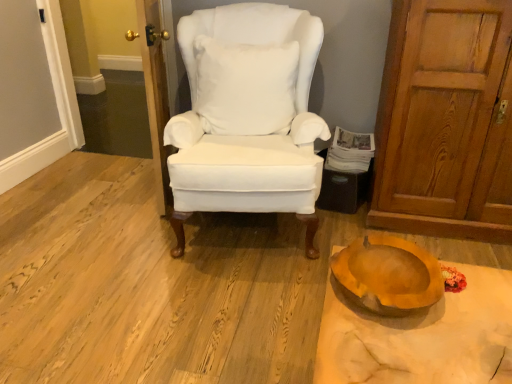
Describe the element at coordinates (422, 337) in the screenshot. I see `wooden bowl at lower right` at that location.

Find the location of a particular element. The height and width of the screenshot is (384, 512). wooden bowl at lower right is located at coordinates (422, 337).

Describe the element at coordinates (245, 87) in the screenshot. The width and height of the screenshot is (512, 384). I see `white fluffy pillow at center` at that location.

What do you see at coordinates (248, 131) in the screenshot? The width and height of the screenshot is (512, 384). I see `white fabric chair at center` at bounding box center [248, 131].

Image resolution: width=512 pixels, height=384 pixels. I want to click on wooden bowl at lower right, so click(422, 337).

Does wooden door at left, which is counted as the second door, starting from the right, have a smaller size compared to white fabric chair at center?

Indeed, wooden door at left, which is counted as the second door, starting from the right, has a smaller size compared to white fabric chair at center.

Is wooden door at left, which is counted as the second door, starting from the right, positioned with its back to white fabric chair at center?

Yes, wooden door at left, which is counted as the second door, starting from the right,'s orientation is away from white fabric chair at center.

Can you confirm if wooden door at left, the 1th door positioned from the left, is positioned to the right of white fabric chair at center?

Incorrect, wooden door at left, the 1th door positioned from the left, is not on the right side of white fabric chair at center.

Locate an element on the screen. table below the white fabric chair at center (from the image's perspective) is located at coordinates (422, 337).

Is white fabric chair at center not close to wooden bowl at lower right?

That's right, there is a large distance between white fabric chair at center and wooden bowl at lower right.

From a real-world perspective, who is located higher, white fabric chair at center or wooden bowl at lower right?

In real-world perspective, white fabric chair at center is above.

Can you confirm if white fabric chair at center is positioned to the left of wooden bowl at lower right?

Yes.

Between matte orange bowl at lower right and wooden door at left, the 1th door positioned from the left, which one appears on the left side from the viewer's perspective?

From the viewer's perspective, wooden door at left, the 1th door positioned from the left, appears more on the left side.

Based on the photo, which point is more forward, [362,267] or [155,165]?

The point [362,267] is closer.

Is matte orange bowl at lower right turned away from wooden door at left, which is counted as the second door, starting from the right?

No, wooden door at left, which is counted as the second door, starting from the right, is not at the back of matte orange bowl at lower right.

Can you see matte orange bowl at lower right touching wooden door at left, which is counted as the second door, starting from the right?

matte orange bowl at lower right is not next to wooden door at left, which is counted as the second door, starting from the right, and they're not touching.

You are a GUI agent. You are given a task and a screenshot of the screen. Output one action in this format:
    pyautogui.click(x=<x>, y=<y>)
    Task: Click on the table located below the wooden door at right, arranged as the first door when viewed from the right (from the image's perspective)
    The width and height of the screenshot is (512, 384).
    Given the screenshot: What is the action you would take?
    pyautogui.click(x=422, y=337)

Considering the sizes of objects wooden door at right, arranged as the first door when viewed from the right, and wooden bowl at lower right in the image provided, who is shorter, wooden door at right, arranged as the first door when viewed from the right, or wooden bowl at lower right?

wooden bowl at lower right is shorter.

Is wooden door at right, arranged as the first door when viewed from the right, thinner than wooden bowl at lower right?

Indeed, wooden door at right, arranged as the first door when viewed from the right, has a lesser width compared to wooden bowl at lower right.

Can we say wooden door at right, the second door positioned from the left, lies outside wooden bowl at lower right?

Indeed, wooden door at right, the second door positioned from the left, is completely outside wooden bowl at lower right.

Can you tell me how much matte orange bowl at lower right and white fabric chair at center differ in facing direction?

They differ by 99.6 degrees in their facing directions.

Is matte orange bowl at lower right facing towards white fabric chair at center?

No.

Is matte orange bowl at lower right to the left or to the right of white fabric chair at center in the image?

matte orange bowl at lower right is positioned on white fabric chair at center's right side.

Is matte orange bowl at lower right taller or shorter than white fabric chair at center?

matte orange bowl at lower right is shorter than white fabric chair at center.

Does wooden door at left, the 1th door positioned from the left, have a smaller size compared to white fluffy pillow at center?

No, wooden door at left, the 1th door positioned from the left, is not smaller than white fluffy pillow at center.

Is wooden door at left, which is counted as the second door, starting from the right, directly adjacent to white fluffy pillow at center?

No.

Does point (166, 189) come closer to viewer compared to point (232, 75)?

That is False.

Is the surface of white fabric chair at center in direct contact with white paper magazine at right?

white fabric chair at center and white paper magazine at right are clearly separated.

Is white fabric chair at center positioned beyond the bounds of white paper magazine at right?

That's correct, white fabric chair at center is outside of white paper magazine at right.

Looking at the image, does white fabric chair at center seem bigger or smaller compared to white paper magazine at right?

In the image, white fabric chair at center appears to be larger than white paper magazine at right.

From a real-world perspective, who is located higher, white fabric chair at center or white paper magazine at right?

white fabric chair at center is physically above.

At what (x,y) coordinates should I click in order to perform the action: click on chair below the wooden door at left, which is counted as the second door, starting from the right (from the image's perspective). Please return your answer as a coordinate pair (x, y). The height and width of the screenshot is (384, 512). Looking at the image, I should click on (248, 131).

Where is `chair lying on the left of wooden bowl at lower right`? chair lying on the left of wooden bowl at lower right is located at coordinates [248, 131].

Based on their spatial positions, is white fabric chair at center or matte orange bowl at lower right further from white fluffy pillow at center?

matte orange bowl at lower right lies further to white fluffy pillow at center than the other object.

When comparing their distances from white paper magazine at right, does wooden bowl at lower right or wooden door at right, arranged as the first door when viewed from the right, seem closer?

The object closer to white paper magazine at right is wooden door at right, arranged as the first door when viewed from the right.

Looking at the image, which one is located further to white paper magazine at right, white fluffy pillow at center or wooden bowl at lower right?

Among the two, wooden bowl at lower right is located further to white paper magazine at right.

Considering their positions, is wooden door at left, the 1th door positioned from the left, positioned closer to wooden bowl at lower right than white fabric chair at center?

white fabric chair at center lies closer to wooden bowl at lower right than the other object.

From the image, which object appears to be nearer to white paper magazine at right, wooden bowl at lower right or white fluffy pillow at center?

Based on the image, white fluffy pillow at center appears to be nearer to white paper magazine at right.

Estimate the real-world distances between objects in this image. Which object is further from matte orange bowl at lower right, white paper magazine at right or wooden bowl at lower right?

white paper magazine at right is further to matte orange bowl at lower right.

Estimate the real-world distances between objects in this image. Which object is further from white fabric chair at center, wooden door at right, the second door positioned from the left, or white paper magazine at right?

wooden door at right, the second door positioned from the left.

Estimate the real-world distances between objects in this image. Which object is closer to white paper magazine at right, wooden door at left, which is counted as the second door, starting from the right, or white fluffy pillow at center?

Based on the image, white fluffy pillow at center appears to be nearer to white paper magazine at right.

This screenshot has width=512, height=384. I want to click on chair situated between wooden door at left, which is counted as the second door, starting from the right, and white paper magazine at right from left to right, so pyautogui.click(x=248, y=131).

The width and height of the screenshot is (512, 384). What are the coordinates of `pillow between matte orange bowl at lower right and white paper magazine at right along the z-axis` in the screenshot? It's located at (245, 87).

Locate an element on the screen. This screenshot has height=384, width=512. chair between wooden bowl at lower right and white paper magazine at right from front to back is located at coordinates point(248,131).

Locate an element on the screen. chair between wooden door at left, which is counted as the second door, starting from the right, and wooden bowl at lower right in the up-down direction is located at coordinates (248, 131).